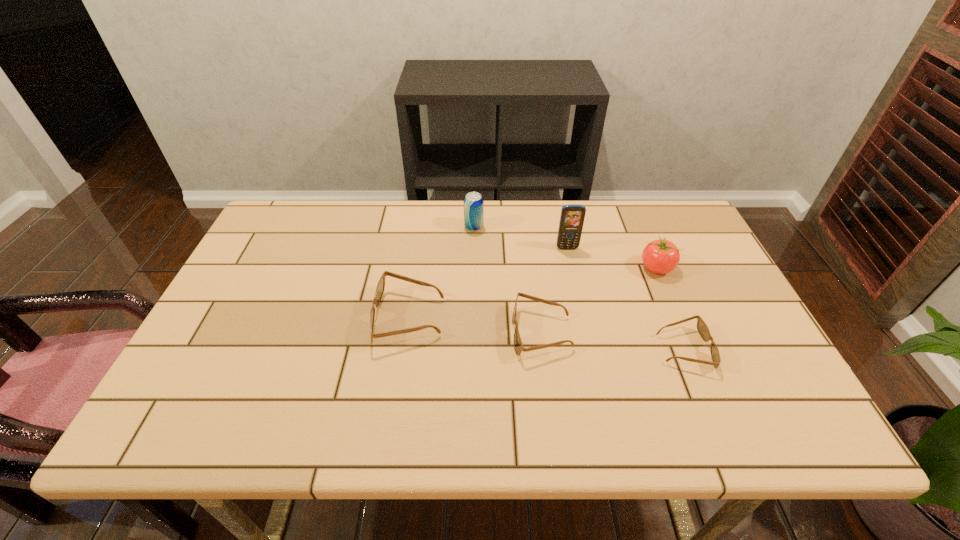
I want to click on vacant space that is in between the beer can and the rightmost sunglasses, so click(579, 288).

Image resolution: width=960 pixels, height=540 pixels. I want to click on blank region between the leftmost sunglasses and the fifth shortest object, so click(x=442, y=272).

I want to click on object that stands as the fourth closest to the third farthest object, so [x=473, y=202].

Locate which object ranks second in proximity to the fifth shortest object. Please provide its 2D coordinates. Your answer should be formatted as a tuple, i.e. [(x, y)], where the tuple contains the x and y coordinates of a point satisfying the conditions above.

[(380, 287)]

Locate an element on the screen. the third closest sunglasses to the fourth nearest object is located at coordinates (380, 287).

Find the location of a particular element. The height and width of the screenshot is (540, 960). sunglasses that is the closest to the tomato is located at coordinates (x=702, y=328).

At what (x,y) coordinates should I click in order to perform the action: click on vacant region that satisfies the following two spatial constraints: 1. on the front side of the fourth shortest object; 2. on the frames of the shortest sunglasses. Please return your answer as a coordinate pair (x, y). Looking at the image, I should click on (691, 349).

Find the location of a particular element. The width and height of the screenshot is (960, 540). vacant space that satisfies the following two spatial constraints: 1. on the screen of the third farthest object; 2. on the right side of the fifth nearest object is located at coordinates (571, 268).

The height and width of the screenshot is (540, 960). What are the coordinates of `free space that satisfies the following two spatial constraints: 1. on the front side of the fifth shortest object; 2. on the frames of the leftmost sunglasses` in the screenshot? It's located at (472, 318).